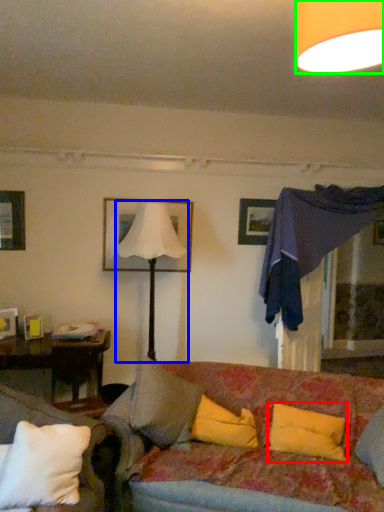
Question: Which is nearer to the pillow (highlighted by a red box)? lamp (highlighted by a blue box) or lamp (highlighted by a green box).

Choices:
 (A) lamp
 (B) lamp

Answer: (A)